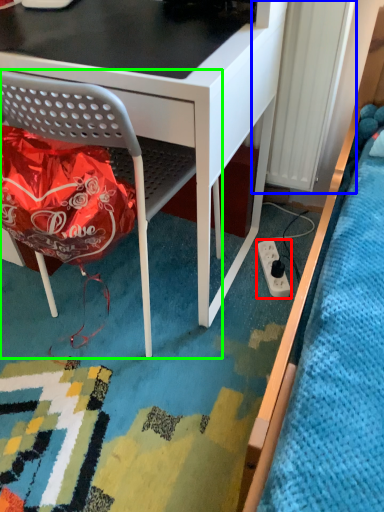
Question: Which object is positioned farthest from power plugs and sockets (highlighted by a red box)? Select from radiator (highlighted by a blue box) and chair (highlighted by a green box).

Choices:
 (A) radiator
 (B) chair

Answer: (B)